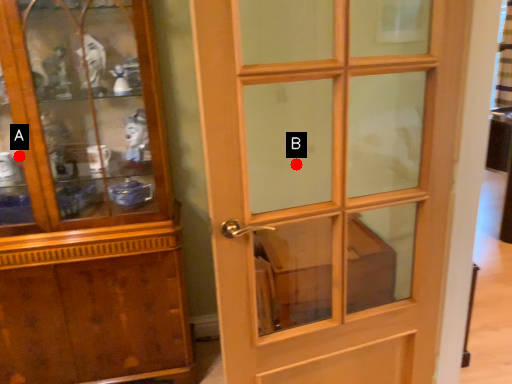
Question: Two points are circled on the image, labeled by A and B beside each circle. Which of the following is the closest to the observer?

Choices:
 (A) A is closer
 (B) B is closer

Answer: (A)